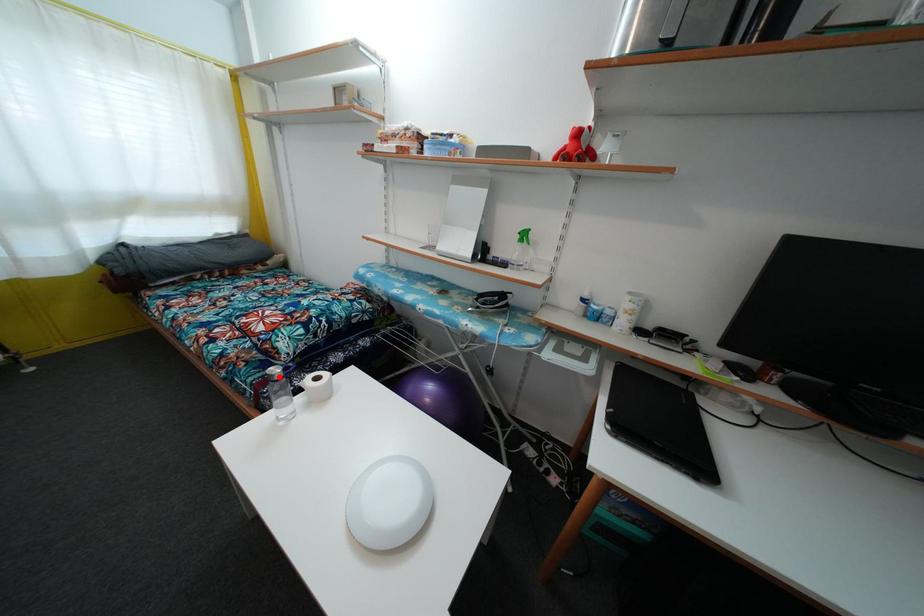
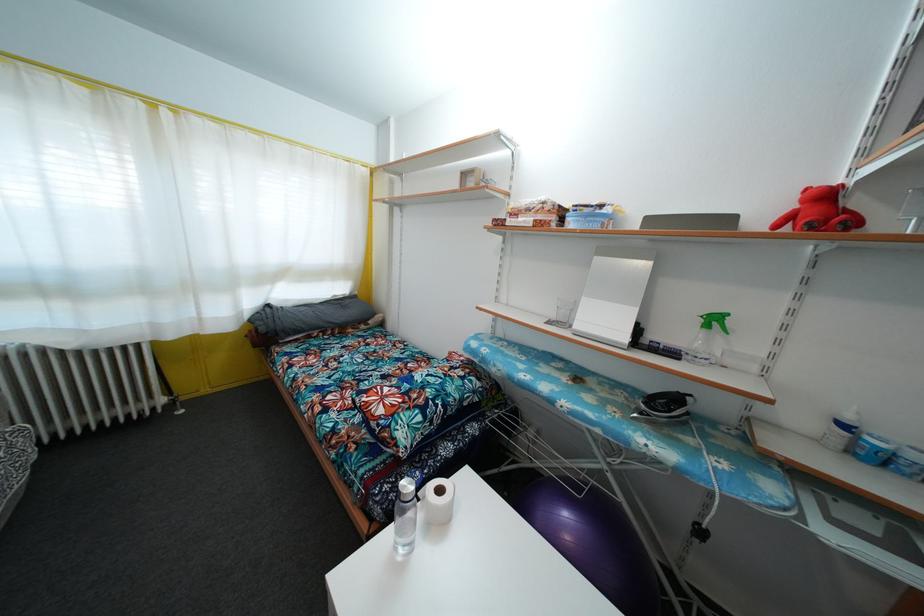
Question: I am providing you with two images of the same scene from different viewpoints. Image1 has a red point marked. In image2, the corresponding 3D location appears at what relative position? Reply with the corresponding letter.

Choices:
 (A) Closer
 (B) Farther

Answer: (A)